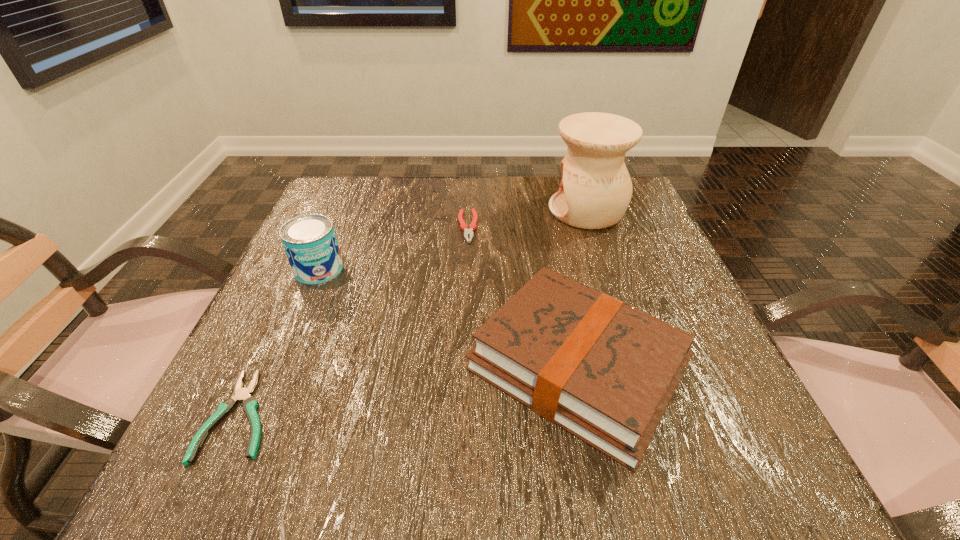
The image size is (960, 540). Identify the location of pliers that is positioned at the left edge. (249, 403).

Locate an element on the screen. This screenshot has height=540, width=960. pottery that is at the right edge is located at coordinates pyautogui.click(x=595, y=190).

Find the location of a particular element. The width and height of the screenshot is (960, 540). hardback book at the right edge is located at coordinates (604, 371).

At what (x,y) coordinates should I click in order to perform the action: click on object located in the near left corner section of the desktop. Please return your answer as a coordinate pair (x, y). Looking at the image, I should click on (249, 403).

Image resolution: width=960 pixels, height=540 pixels. What are the coordinates of `object that is at the far right corner` in the screenshot? It's located at (595, 190).

What are the coordinates of `object that is at the near right corner` in the screenshot? It's located at (604, 371).

You are a GUI agent. You are given a task and a screenshot of the screen. Output one action in this format:
    pyautogui.click(x=<x>, y=<y>)
    Task: Click on the vacant space at the far edge
    
    Given the screenshot: What is the action you would take?
    pyautogui.click(x=466, y=195)

In order to click on blank space at the near edge of the desktop in this screenshot , I will do `click(373, 489)`.

Image resolution: width=960 pixels, height=540 pixels. Find the location of `blank space at the left edge`. blank space at the left edge is located at coordinates (228, 380).

I want to click on vacant area at the right edge, so click(603, 234).